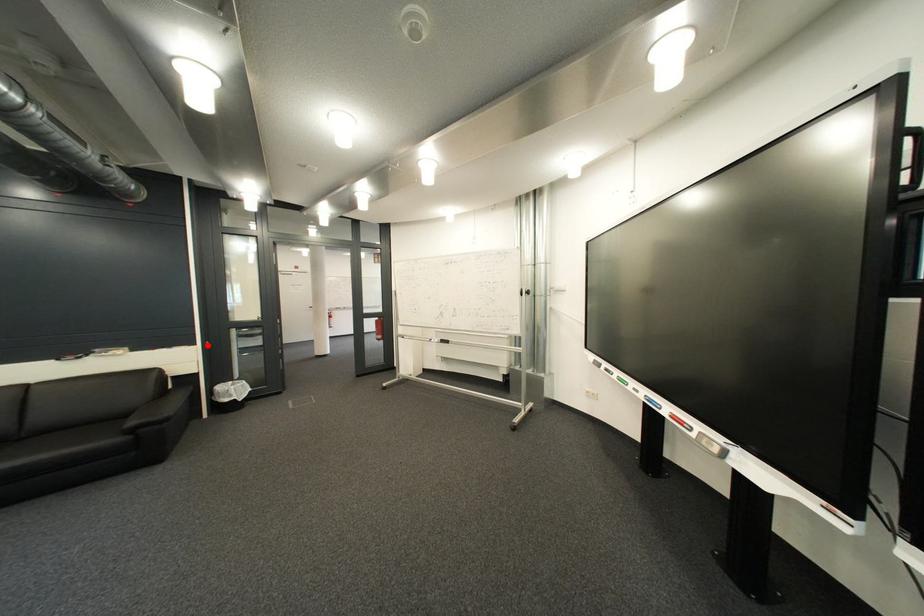
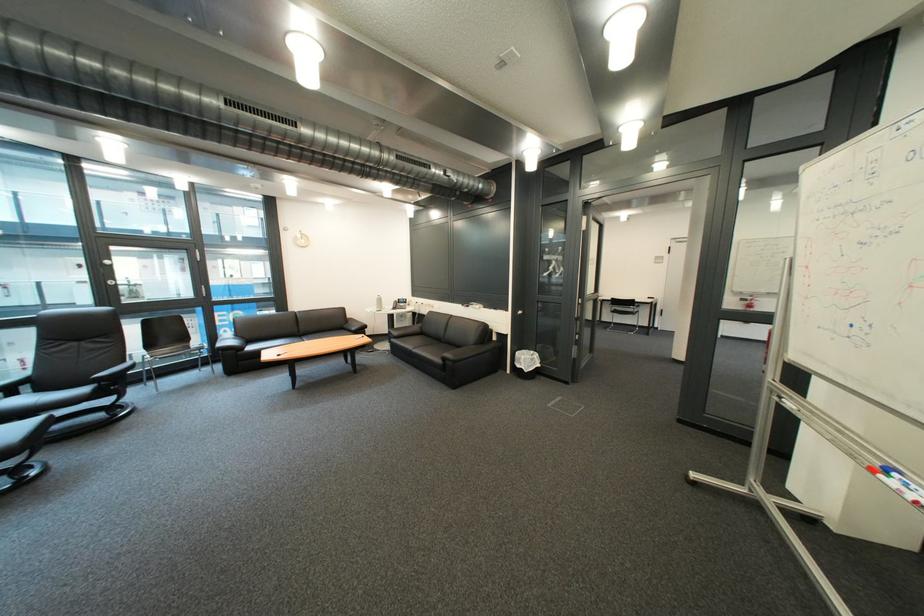
Where in the second image is the point corresponding to the highlighted location from the first image?

(520, 312)